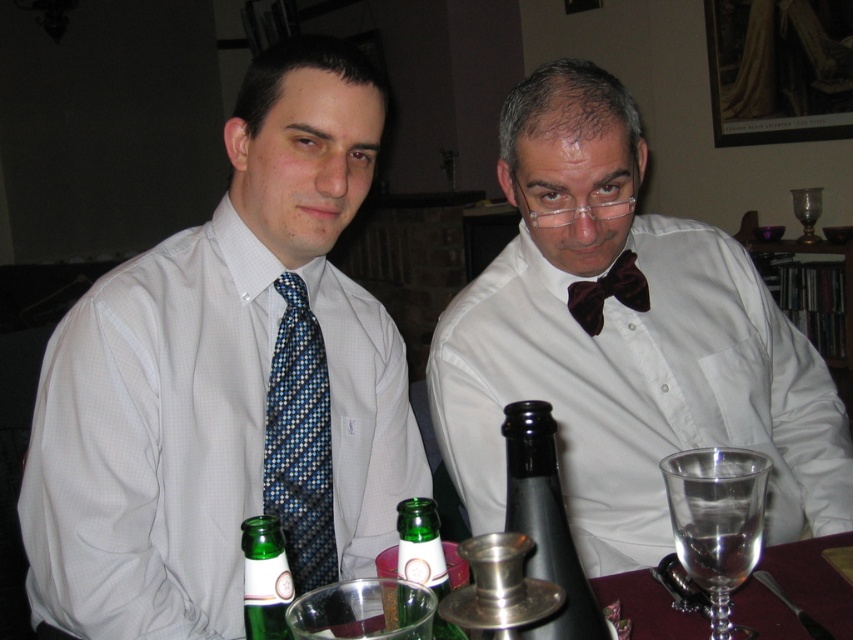
Question: Is clear glass wine glass at lower right thinner than green glass bottle at center?

Choices:
 (A) no
 (B) yes

Answer: (A)

Question: Which of these objects is positioned farthest from the matte black bow tie at center?

Choices:
 (A) blue patterned tie at left
 (B) green glass bottle at center

Answer: (B)

Question: Does matte white shirt at left appear under black glass bottle at center?

Choices:
 (A) yes
 (B) no

Answer: (B)

Question: Does clear glass wine at lower right appear on the right side of brown velvet bow tie at center?

Choices:
 (A) yes
 (B) no

Answer: (A)

Question: Which object is farther from the camera taking this photo?

Choices:
 (A) matte black bow tie at center
 (B) blue patterned tie at left
 (C) matte white shirt at left
 (D) black glass bottle at center

Answer: (A)

Question: Which is farther from the green glass bottle at center?

Choices:
 (A) matte black bow tie at center
 (B) matte white shirt at left

Answer: (A)